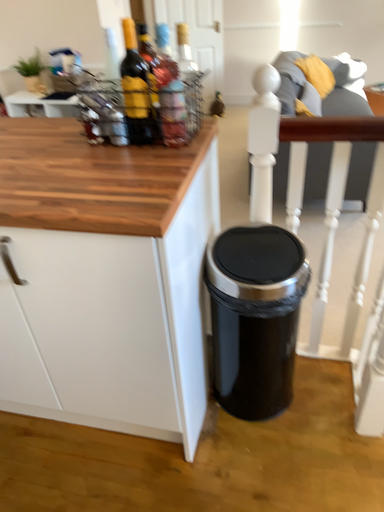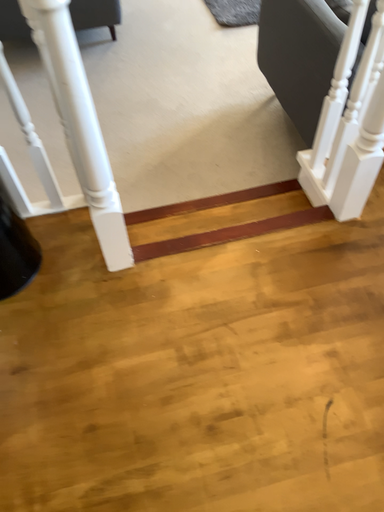
Question: Which way did the camera rotate in the video?

Choices:
 (A) rotated upward
 (B) rotated downward

Answer: (B)